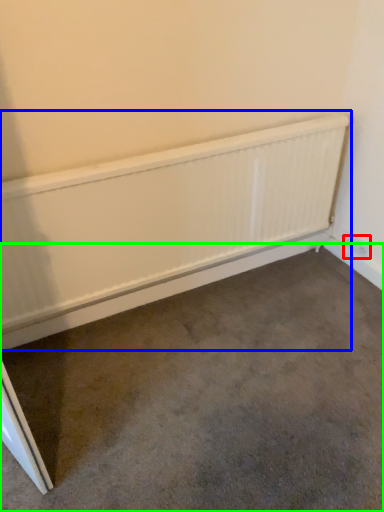
Question: Which object is positioned farthest from electric outlet (highlighted by a red box)? Select from radiator (highlighted by a blue box) and concrete (highlighted by a green box).

Choices:
 (A) radiator
 (B) concrete

Answer: (B)